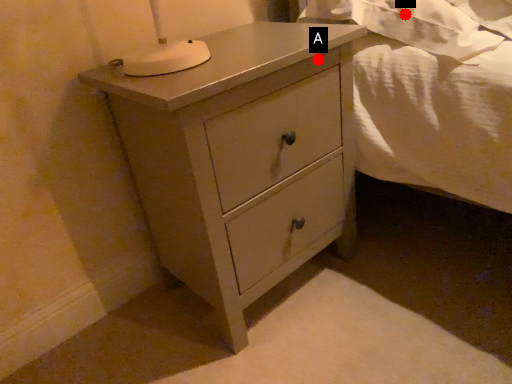
Question: Two points are circled on the image, labeled by A and B beside each circle. Which of the following is the farthest from the observer?

Choices:
 (A) A is further
 (B) B is further

Answer: (B)